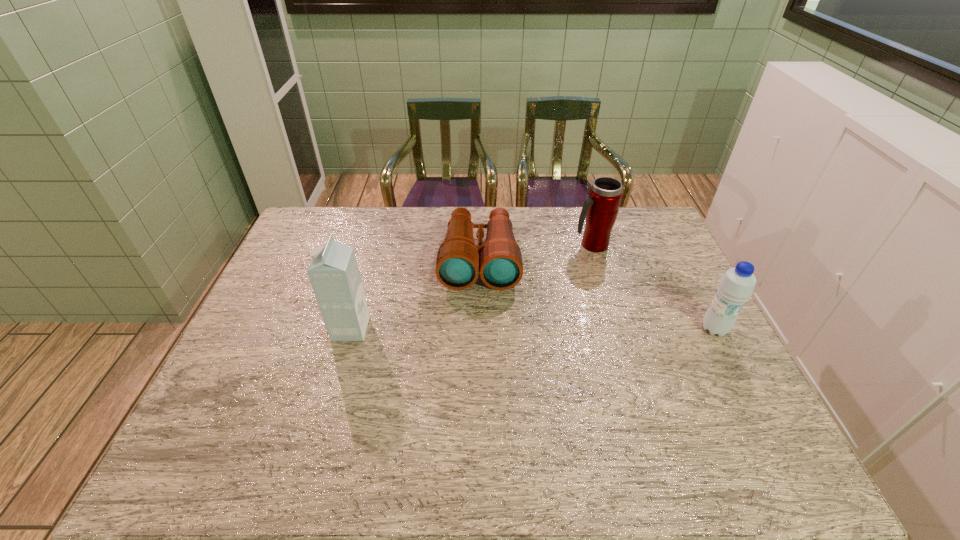
Where is `free location located 0.110m through the lenses of the third object from right to left`? free location located 0.110m through the lenses of the third object from right to left is located at coordinates (479, 318).

Where is `vacant space situated 0.280m through the lenses of the third object from right to left`? This screenshot has width=960, height=540. vacant space situated 0.280m through the lenses of the third object from right to left is located at coordinates (478, 366).

Locate an element on the screen. This screenshot has height=540, width=960. vacant space located through the lenses of the third object from right to left is located at coordinates (477, 408).

You are a GUI agent. You are given a task and a screenshot of the screen. Output one action in this format:
    pyautogui.click(x=<x>, y=<y>)
    Task: Click on the free spot located 0.080m on the side with the handle of the thermos bottle
    The width and height of the screenshot is (960, 540).
    Given the screenshot: What is the action you would take?
    pyautogui.click(x=579, y=267)

You are a GUI agent. You are given a task and a screenshot of the screen. Output one action in this format:
    pyautogui.click(x=<x>, y=<y>)
    Task: Click on the vacant space located 0.300m on the side with the handle of the thermos bottle
    The height and width of the screenshot is (540, 960).
    Given the screenshot: What is the action you would take?
    pyautogui.click(x=557, y=312)

This screenshot has height=540, width=960. I want to click on vacant space located 0.350m on the side with the handle of the thermos bottle, so click(551, 323).

This screenshot has height=540, width=960. I want to click on binoculars situated at the far edge, so click(457, 266).

What are the coordinates of `thermos bottle located at the far edge` in the screenshot? It's located at (601, 208).

At what (x,y) coordinates should I click in order to perform the action: click on object present at the right edge. Please return your answer as a coordinate pair (x, y). This screenshot has width=960, height=540. Looking at the image, I should click on (736, 286).

In the image, there is a desktop. Identify the location of free region at the far edge. This screenshot has width=960, height=540. (528, 211).